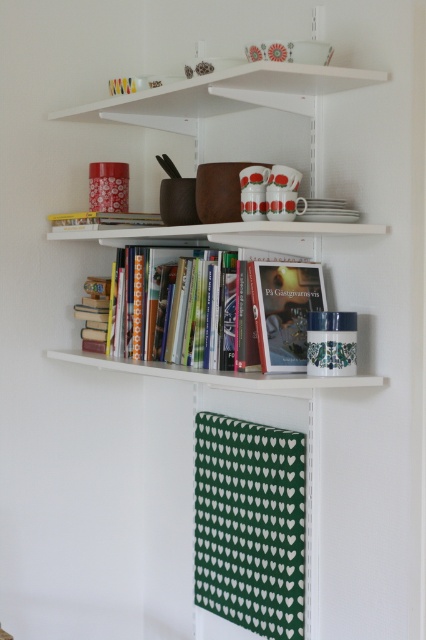
You are organizing a bookshelf and want to place the green paper book at center and the hardcover books at center side by side. Which one requires more horizontal space?

The hardcover books at center require more horizontal space because they are wider than the green paper book at center.

You are arranging a bookshelf and want to place a new book on the shelf above the hardcover books at center. Is there space available on the white matte bookshelf at upper center?

The white matte bookshelf at upper center is located above the hardcover books at center, so there is space available on the white matte bookshelf at upper center to place the new book.

You are arranging books on the white matte bookshelf at upper center and the green paper book at center. Which object is closer to you when you are standing in front of the shelf unit?

The green paper book at center is closer to you because the white matte bookshelf at upper center is behind it.